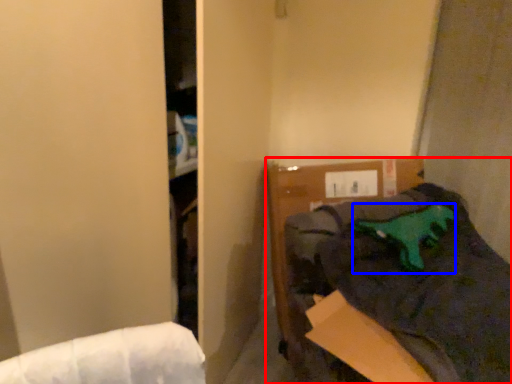
Question: Which object is further to the camera taking this photo, furniture (highlighted by a red box) or animal (highlighted by a blue box)?

Choices:
 (A) furniture
 (B) animal

Answer: (B)